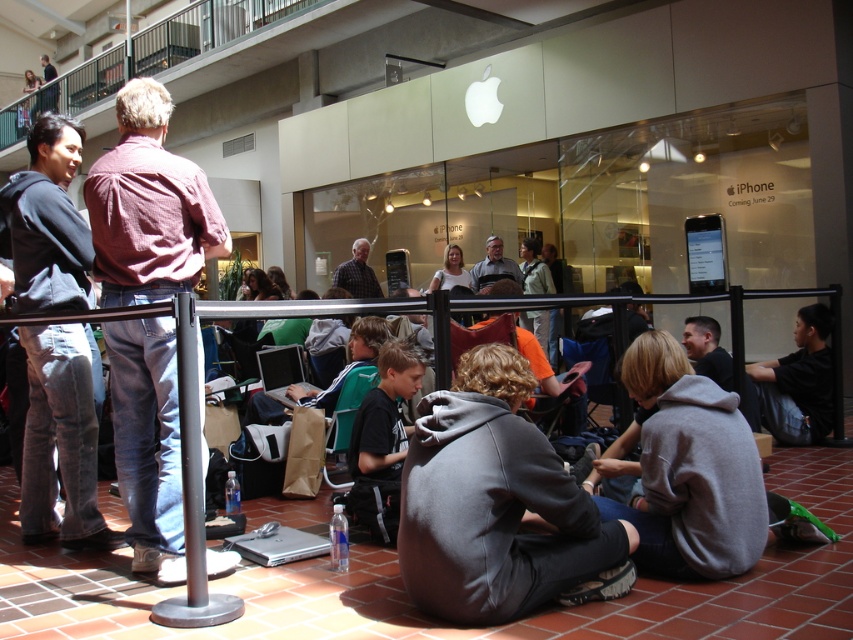
Question: Is the position of green fabric chair at center more distant than that of white fabric shirt at center?

Choices:
 (A) yes
 (B) no

Answer: (B)

Question: Estimate the real-world distances between objects in this image. Which object is closer to the reddish-brown shirt at left?

Choices:
 (A) plaid shirt at center
 (B) gray fleece sweatshirt at center

Answer: (B)

Question: Which object is positioned closest to the green fabric chair at center?

Choices:
 (A) plaid shirt at center
 (B) gray hoodie at lower center
 (C) reddish-brown shirt at left

Answer: (C)

Question: Which is nearer to the green fabric chair at center?

Choices:
 (A) black cotton hoodie at lower right
 (B) white fabric shirt at center

Answer: (A)

Question: Does gray hoodie at lower center appear under black cotton hoodie at lower right?

Choices:
 (A) yes
 (B) no

Answer: (A)

Question: Does gray fleece sweatshirt at center appear under green fabric chair at center?

Choices:
 (A) yes
 (B) no

Answer: (B)